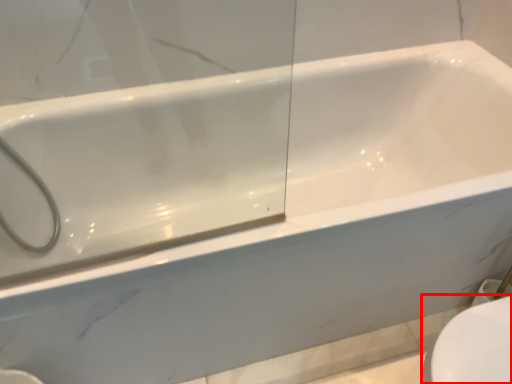
Question: From the image's perspective, where is toilet bowl (annotated by the red box) located relative to shower?

Choices:
 (A) below
 (B) above

Answer: (A)